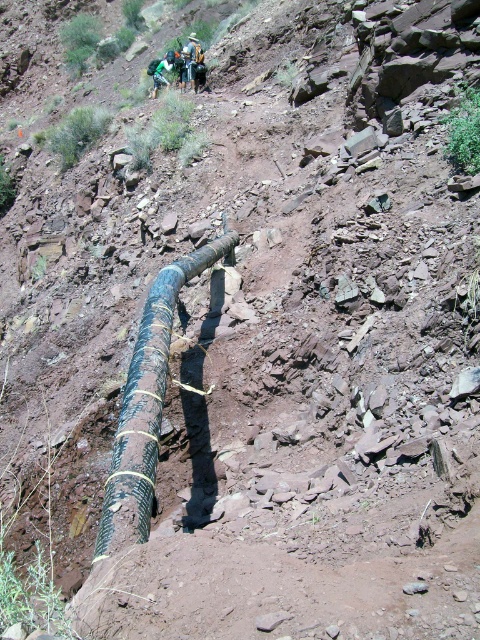
Question: Among these points, which one is nearest to the camera?

Choices:
 (A) (157, 300)
 (B) (194, 61)
 (C) (163, 83)

Answer: (A)

Question: Does black rubber pipe at center have a greater width compared to green fabric backpack at center?

Choices:
 (A) no
 (B) yes

Answer: (B)

Question: Which point appears closest to the camera in this image?

Choices:
 (A) (199, 52)
 (B) (186, 276)
 (C) (152, 60)

Answer: (B)

Question: Can you confirm if brushed metal backpack at upper center is thinner than green fabric backpack at center?

Choices:
 (A) no
 (B) yes

Answer: (A)

Question: Which point is farther to the camera?

Choices:
 (A) (142, 381)
 (B) (157, 68)

Answer: (B)

Question: Where is black rubber pipe at center located in relation to green fabric backpack at center in the image?

Choices:
 (A) above
 (B) below

Answer: (B)